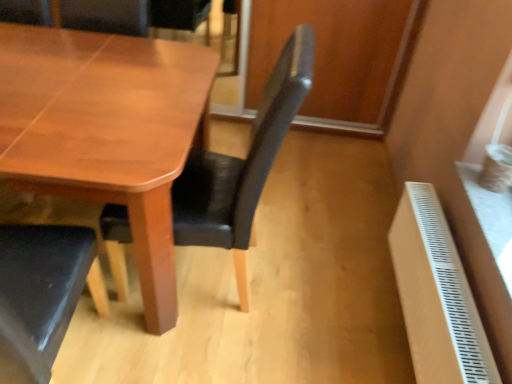
Where is `free location to the right of satin black chair at center`? The image size is (512, 384). free location to the right of satin black chair at center is located at coordinates (318, 286).